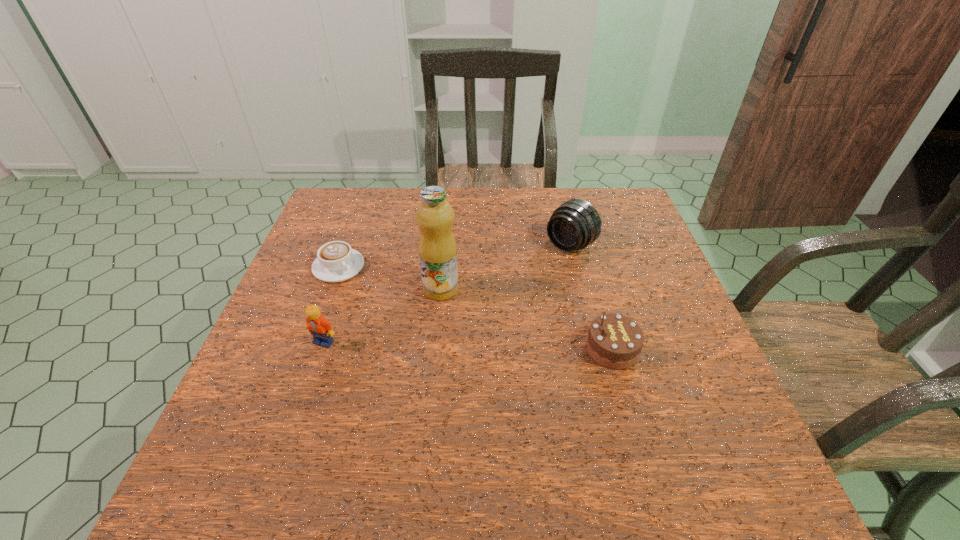
The height and width of the screenshot is (540, 960). In order to click on vacant space on the desktop that is between the Lego and the second shortest object and is positioned with the handle on the right side of the cappuccino in this screenshot , I will do `click(433, 345)`.

Where is `vacant space on the desktop that is between the third shortest object and the fourth tallest object and is positioned at the front element of the telephoto lens`? vacant space on the desktop that is between the third shortest object and the fourth tallest object and is positioned at the front element of the telephoto lens is located at coordinates tap(445, 345).

The width and height of the screenshot is (960, 540). In order to click on free space on the desktop that is between the Lego and the chocolate cake and is positioned on the front label of the tallest object in this screenshot , I will do `click(505, 347)`.